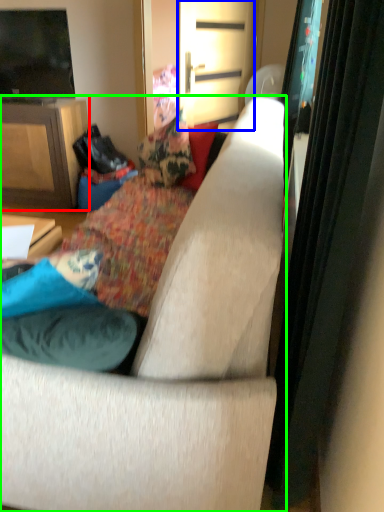
Question: Which object is positioned closest to cabinetry (highlighted by a red box)? Select from screen door (highlighted by a blue box) and studio couch (highlighted by a green box).

Choices:
 (A) screen door
 (B) studio couch

Answer: (A)